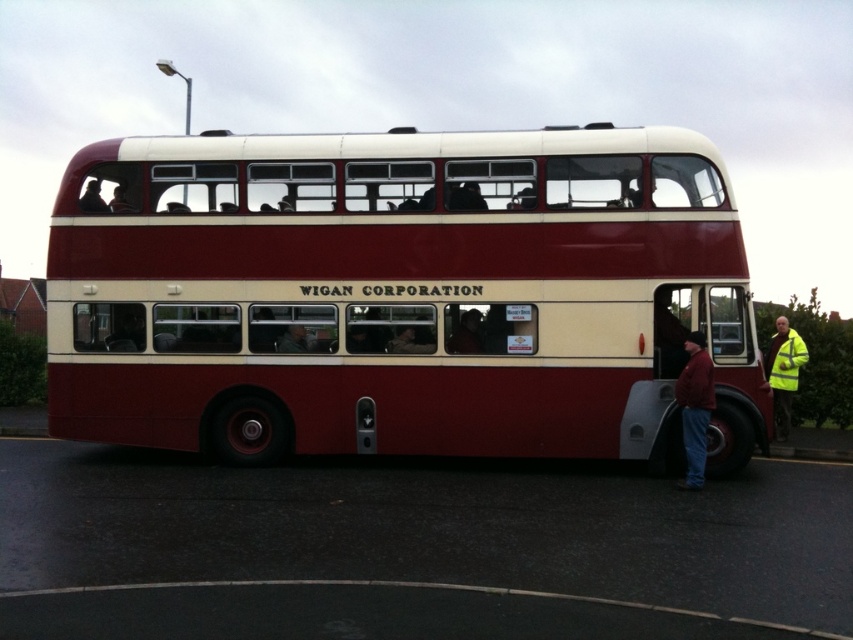
Between maroon matte double-decker bus at center and smooth black hair at upper left, which one has less height?

smooth black hair at upper left is shorter.

Is maroon matte double-decker bus at center further to camera compared to smooth black hair at upper left?

No.

Identify the location of maroon matte double-decker bus at center. (401, 296).

Where is `maroon matte double-decker bus at center`? maroon matte double-decker bus at center is located at coordinates (401, 296).

Where is `maroon matte double-decker bus at center`? This screenshot has width=853, height=640. maroon matte double-decker bus at center is located at coordinates pyautogui.click(x=401, y=296).

Who is more forward, (437, 216) or (776, 428)?

Point (437, 216) is more forward.

Locate an element on the screen. This screenshot has height=640, width=853. maroon matte double-decker bus at center is located at coordinates (401, 296).

From the picture: Can you confirm if black asphalt at lower center is taller than red jacket at lower right?

Incorrect, black asphalt at lower center's height is not larger of red jacket at lower right's.

Is point (804, 468) farther from viewer compared to point (706, 413)?

Yes, it is.

What do you see at coordinates (431, 540) in the screenshot? I see `black asphalt at lower center` at bounding box center [431, 540].

The width and height of the screenshot is (853, 640). In order to click on black asphalt at lower center in this screenshot , I will do `click(431, 540)`.